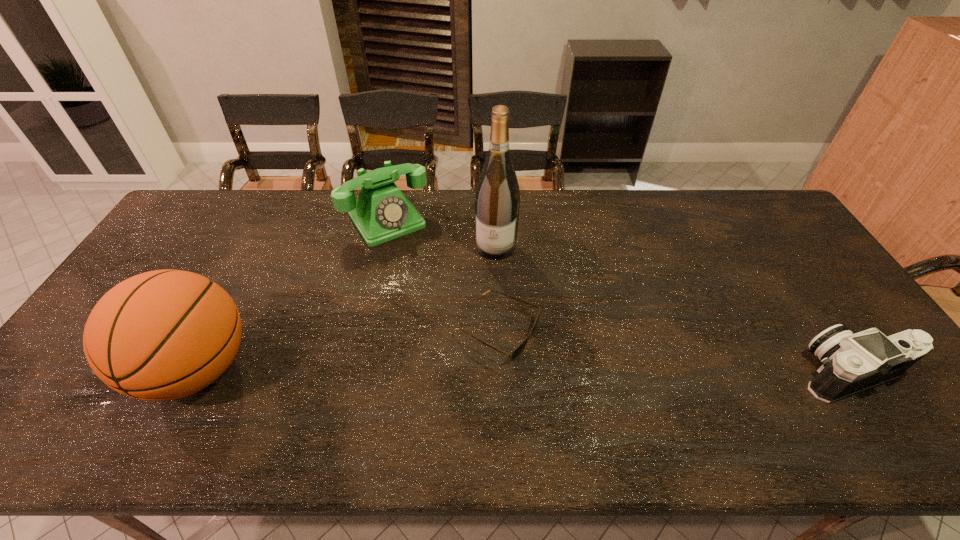
This screenshot has height=540, width=960. Find the location of `vacant space on the desktop that is between the fourth shortest object and the camera and is positioned on the label of the tallest object`. vacant space on the desktop that is between the fourth shortest object and the camera and is positioned on the label of the tallest object is located at coordinates (469, 370).

Where is `vacant space on the desktop that is between the leftmost object and the camera and is positioned on the dial of the fourth object from right to left`? Image resolution: width=960 pixels, height=540 pixels. vacant space on the desktop that is between the leftmost object and the camera and is positioned on the dial of the fourth object from right to left is located at coordinates (494, 371).

I want to click on free space on the desktop that is between the fourth shortest object and the fourth tallest object and is positioned on the lenses of the shortest object, so click(x=584, y=372).